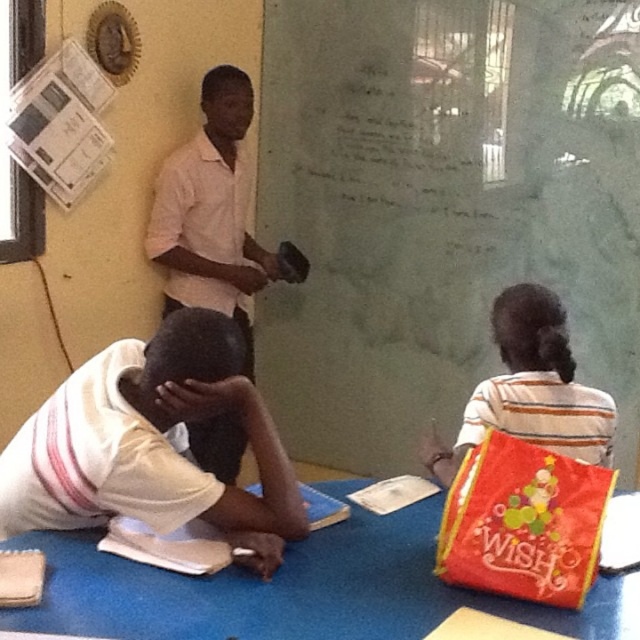
You are standing in the classroom shown in the image. The green matte chalkboard at center is where the teacher writes lessons. If you want to see the chalkboard clearly, should you move closer to the blue table or move away from it?

The green matte chalkboard at center is positioned at point (442, 205), which means it is located in the lower central part of the image. Since you are currently at the blue table in the foreground, moving closer to the blue table would bring you nearer to the chalkboard, allowing for a clearer view.

You are a teacher standing at the front of the classroom. You need to write something on the green matte chalkboard at center and then check on the white shirt at upper center. Which object will you reach first?

The green matte chalkboard at center is closer to the viewer than the white shirt at upper center, so you will reach the green matte chalkboard at center first before checking on the white shirt at upper center.